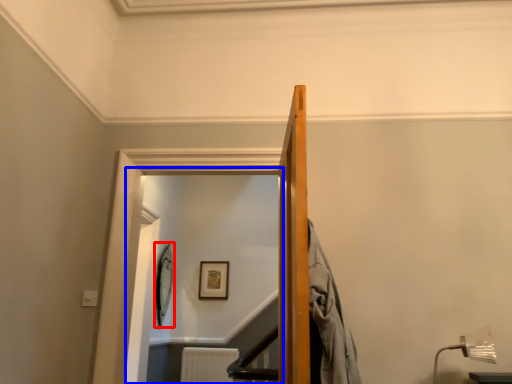
Question: Which of the following is the closest to the observer, picture frame (highlighted by a red box) or glass door (highlighted by a blue box)?

Choices:
 (A) picture frame
 (B) glass door

Answer: (B)